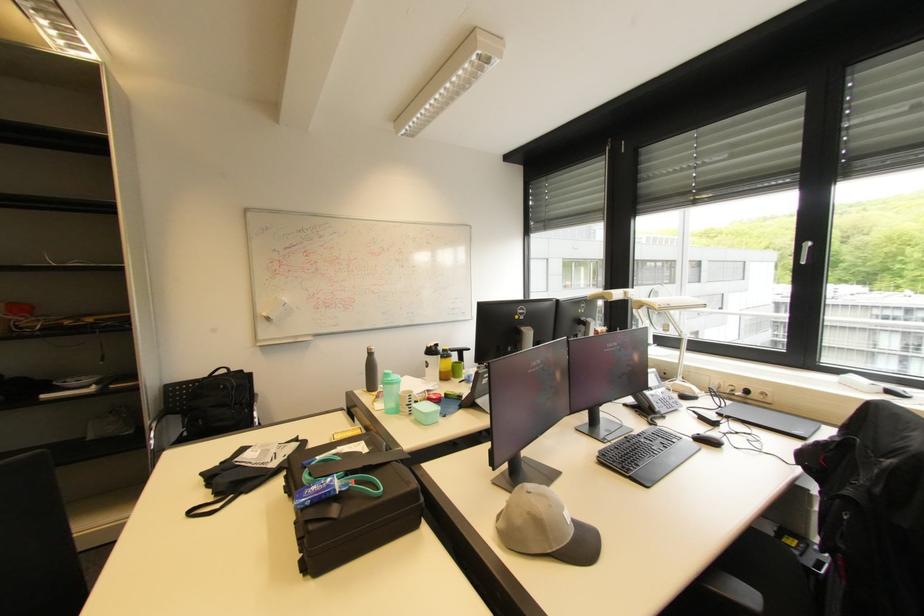
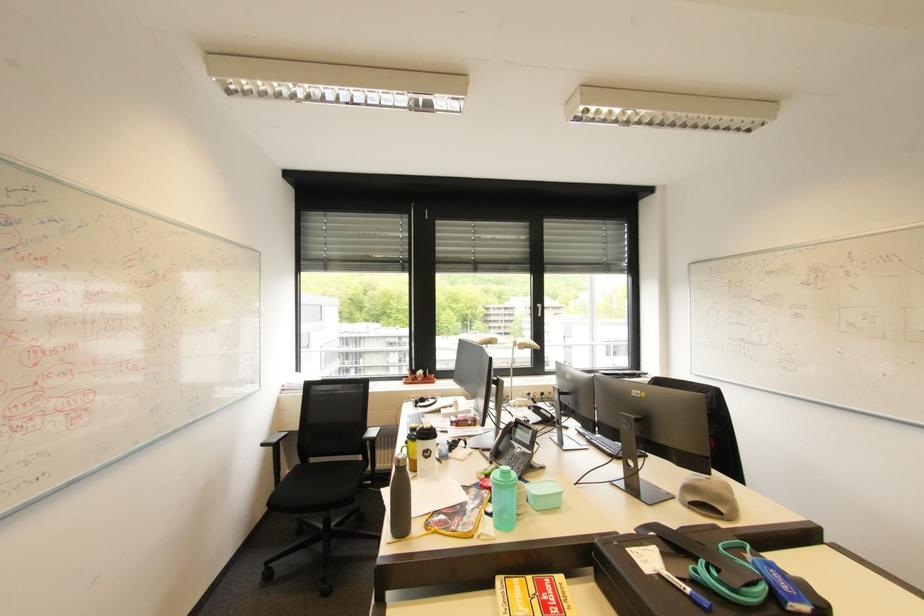
Locate, in the second image, the point that corresponds to the point at 349,436 in the first image.

(526, 602)